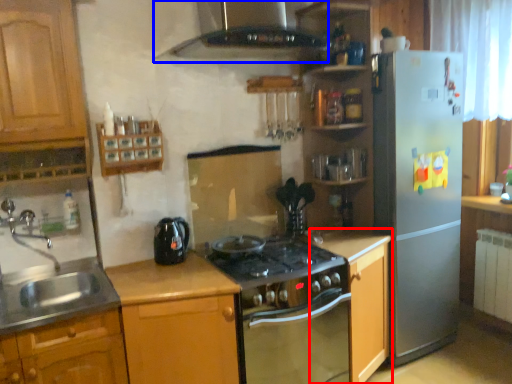
Question: Among these objects, which one is farthest to the camera, cabinetry (highlighted by a red box) or exhaust hood (highlighted by a blue box)?

Choices:
 (A) cabinetry
 (B) exhaust hood

Answer: (A)